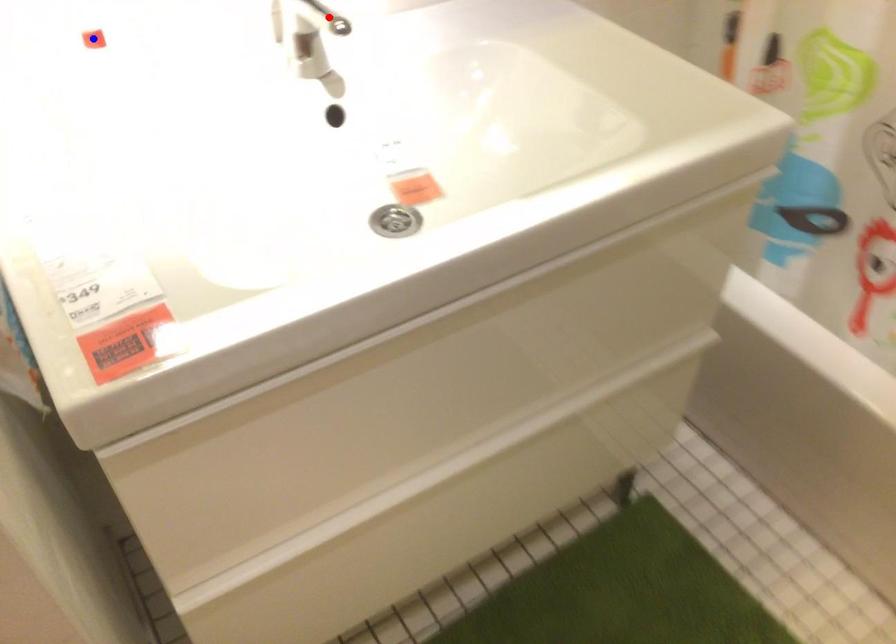
Question: Two points are marked on the image. Which point is closer to the camera?

Choices:
 (A) Blue point is closer.
 (B) Red point is closer.

Answer: (A)